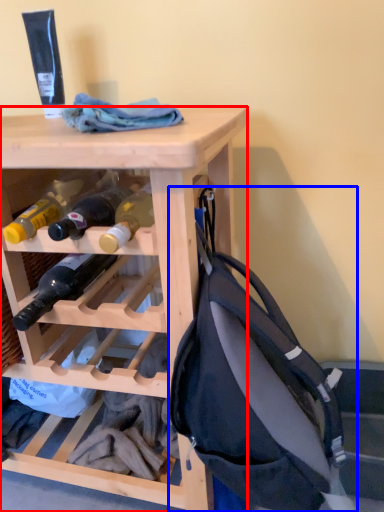
Question: Among these objects, which one is nearest to the camera, desk (highlighted by a red box) or backpack (highlighted by a blue box)?

Choices:
 (A) desk
 (B) backpack

Answer: (B)